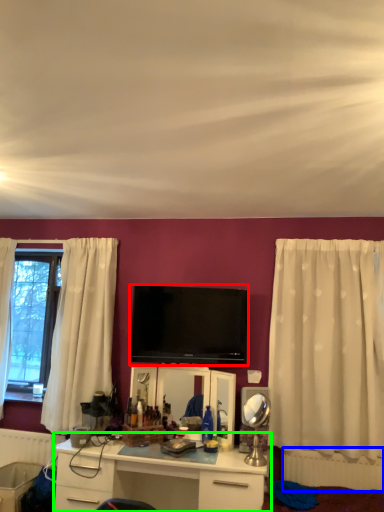
Question: Which object is positioned closest to television (highlighted by a red box)? Select from radiator (highlighted by a blue box) and desk (highlighted by a green box).

Choices:
 (A) radiator
 (B) desk

Answer: (B)